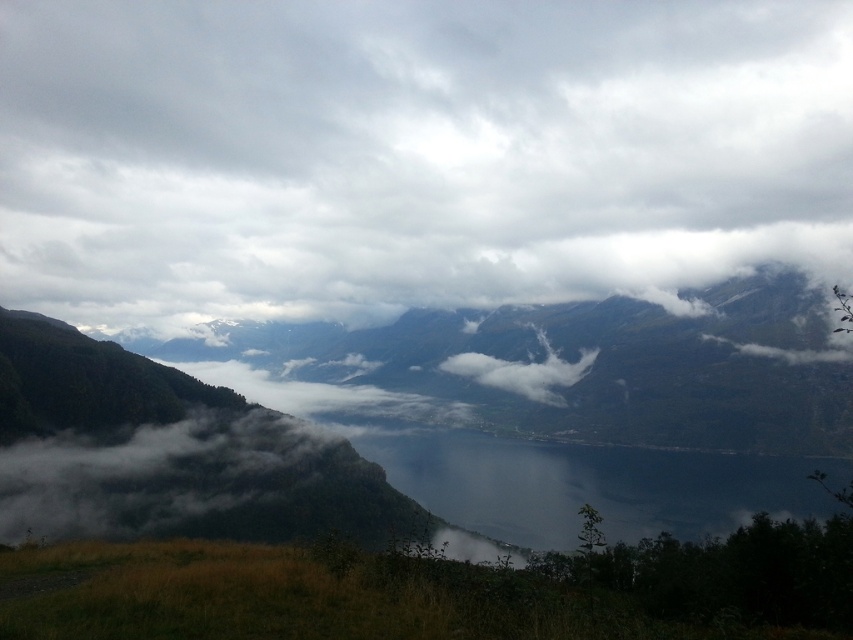
You are an airplane passenger looking out the window and see the green textured mountain at center and the white fluffy cloud at center. Which object is higher in the sky?

The green textured mountain at center is taller than the white fluffy cloud at center, so the mountain is higher in the sky.

Based on the coordinates provided, which object is located at point (x=589, y=365)?

The green textured mountain at center is located at point (x=589, y=365).